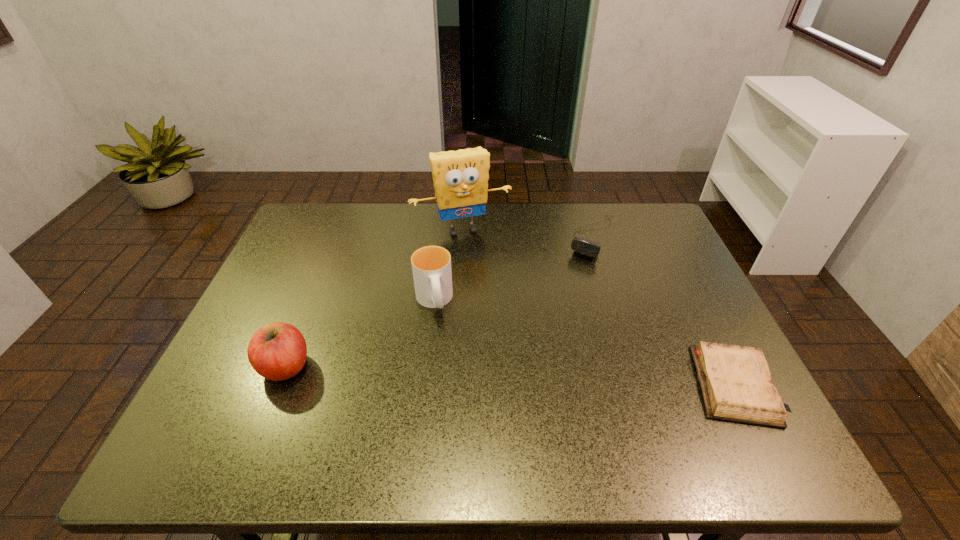
Identify the location of vacant position at the left edge of the desktop. This screenshot has height=540, width=960. (283, 297).

This screenshot has height=540, width=960. I want to click on free region at the right edge of the desktop, so click(x=669, y=349).

The height and width of the screenshot is (540, 960). Find the location of `free location at the near left corner of the desktop`. free location at the near left corner of the desktop is located at coordinates (245, 396).

In the image, there is a desktop. Identify the location of vacant space at the far right corner. (670, 238).

At what (x,y) coordinates should I click in order to perform the action: click on vacant space at the near right corner of the desktop. Please return your answer as a coordinate pair (x, y). Looking at the image, I should click on (685, 408).

I want to click on vacant area that lies between the cup and the webcam, so click(x=513, y=269).

Identify the location of unoccupied position between the second object from right to left and the sponge. The width and height of the screenshot is (960, 540). (527, 233).

Locate an element on the screen. Image resolution: width=960 pixels, height=540 pixels. vacant area that lies between the webcam and the shortest object is located at coordinates (662, 311).

What are the coordinates of `vacant space that's between the apple and the cup` in the screenshot? It's located at (360, 334).

The image size is (960, 540). I want to click on vacant area that lies between the fourth tallest object and the third nearest object, so click(513, 269).